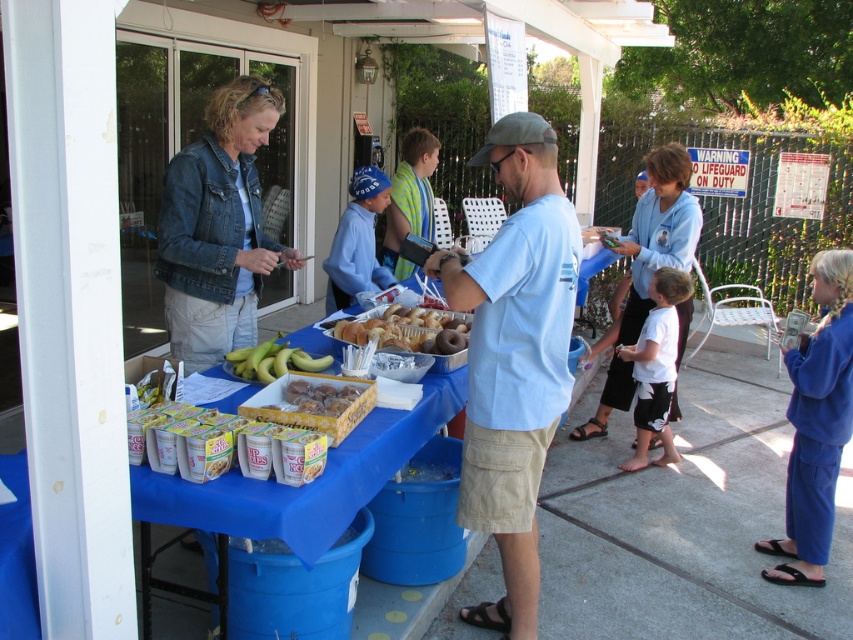
Question: Is light blue t-shirt at center positioned behind yellow matte bananas at center?

Choices:
 (A) no
 (B) yes

Answer: (A)

Question: Which of the following is the closest to the observer?

Choices:
 (A) yellow matte bananas at center
 (B) white cotton shirt at center

Answer: (A)

Question: Does yellow cardboard box of donuts at center have a greater width compared to golden brown glazed donuts at center?

Choices:
 (A) no
 (B) yes

Answer: (A)

Question: Estimate the real-world distances between objects in this image. Which object is closer to the golden brown glazed donuts at center?

Choices:
 (A) yellow matte bananas at center
 (B) light blue t-shirt at center
 (C) white cotton shirt at center
 (D) blue fleece pants at lower right

Answer: (A)

Question: Which of these objects is positioned closest to the yellow matte bananas at center?

Choices:
 (A) golden brown glazed donuts at center
 (B) yellow cardboard box of donuts at center
 (C) light blue t-shirt at center

Answer: (B)

Question: Does white cotton shirt at center have a lesser width compared to yellow matte bananas at center?

Choices:
 (A) yes
 (B) no

Answer: (B)